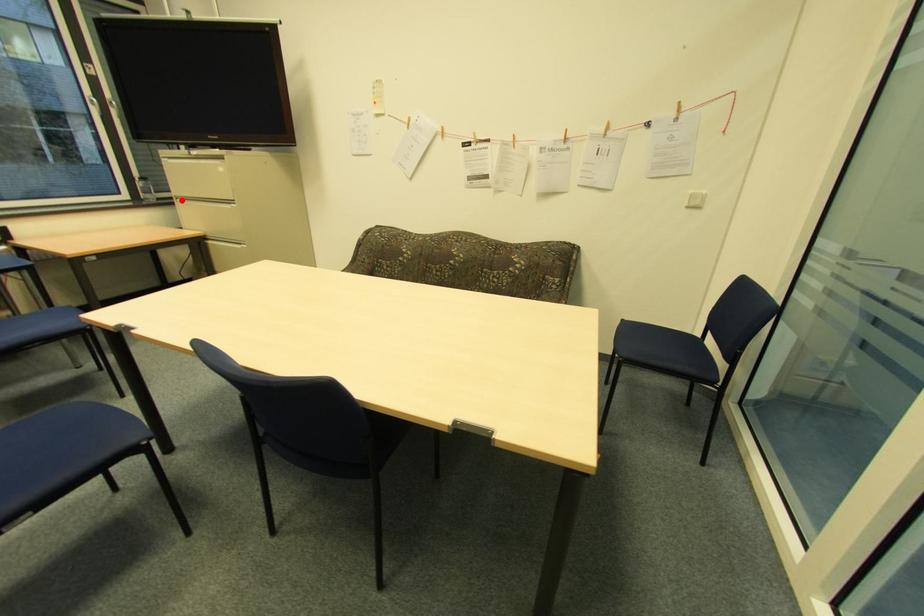
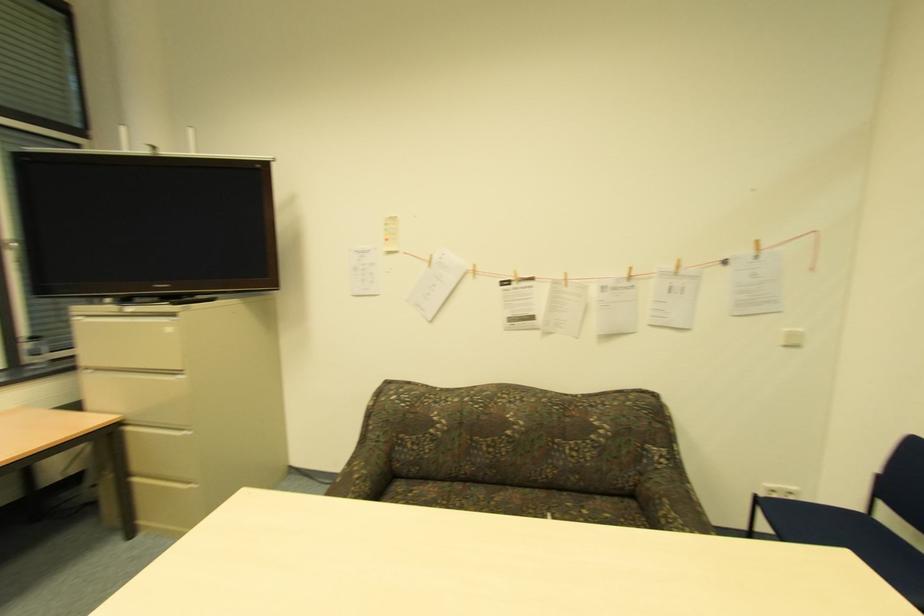
Where in the second image is the point corresponding to the highlighted location from the first image?

(91, 370)